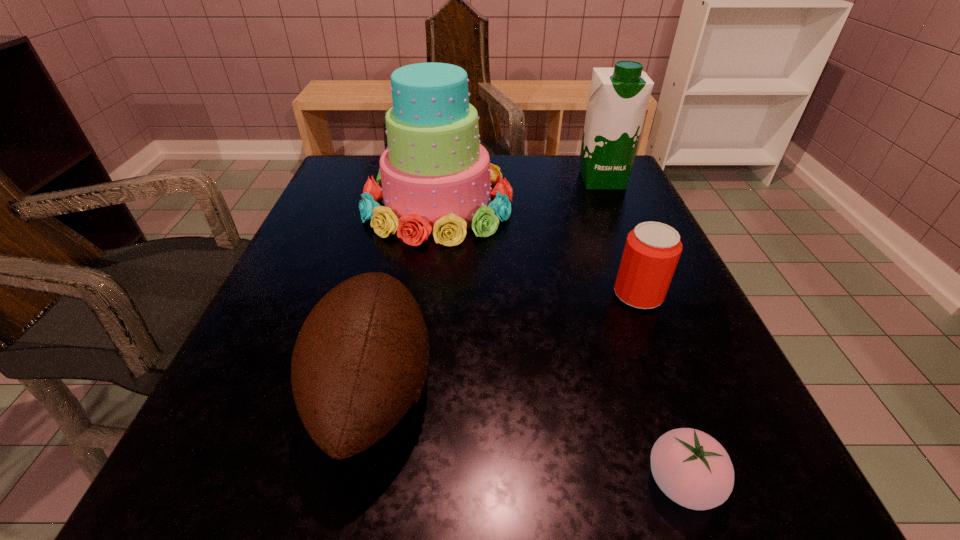
Image resolution: width=960 pixels, height=540 pixels. I want to click on vacant region located on the back of the shortest object, so click(611, 274).

Locate an element on the screen. The image size is (960, 540). cake situated at the far edge is located at coordinates (435, 178).

The image size is (960, 540). Find the location of `soya milk at the far edge`. soya milk at the far edge is located at coordinates (618, 97).

The image size is (960, 540). I want to click on football that is at the near edge, so click(360, 360).

In order to click on tomato present at the near edge in this screenshot , I will do `click(693, 469)`.

Where is `cake that is at the left edge`? cake that is at the left edge is located at coordinates (435, 178).

Locate an element on the screen. The image size is (960, 540). football that is at the left edge is located at coordinates (360, 360).

Where is `soya milk that is positioned at the right edge`? soya milk that is positioned at the right edge is located at coordinates (618, 97).

This screenshot has height=540, width=960. What are the coordinates of `beer can situated at the right edge` in the screenshot? It's located at (652, 250).

Where is `tomato that is at the right edge`? The width and height of the screenshot is (960, 540). tomato that is at the right edge is located at coordinates (693, 469).